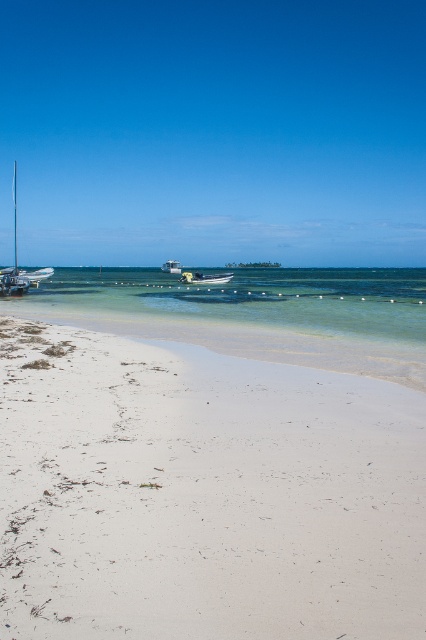
You are a lifeguard on duty at the beach and need to reach the shiny silver sailboat at left as quickly as possible. Which direction should you head towards from your current position at the center of the beach?

Since the shiny silver sailboat at left is located at coordinates point (x=14, y=259), which is to the left side of the beach, you should head towards the left direction from the center of the beach to reach it quickly.

You are standing on the beach and want to board the shiny silver sailboat at left and the white matte boat at center. Which boat will require you to climb higher to get on board?

The shiny silver sailboat at left is much taller than the white matte boat at center, so you will need to climb higher to board the shiny silver sailboat at left.